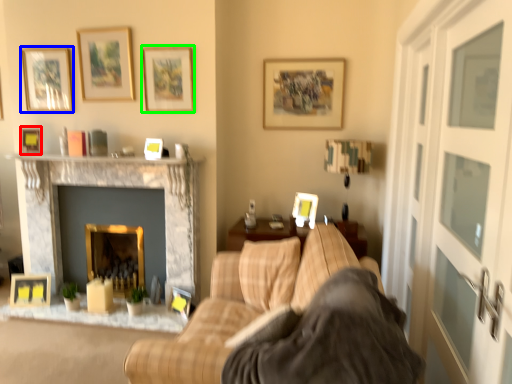
Question: Estimate the real-world distances between objects in this image. Which object is closer to picture frame (highlighted by a red box), picture frame (highlighted by a blue box) or picture frame (highlighted by a green box)?

Choices:
 (A) picture frame
 (B) picture frame

Answer: (A)